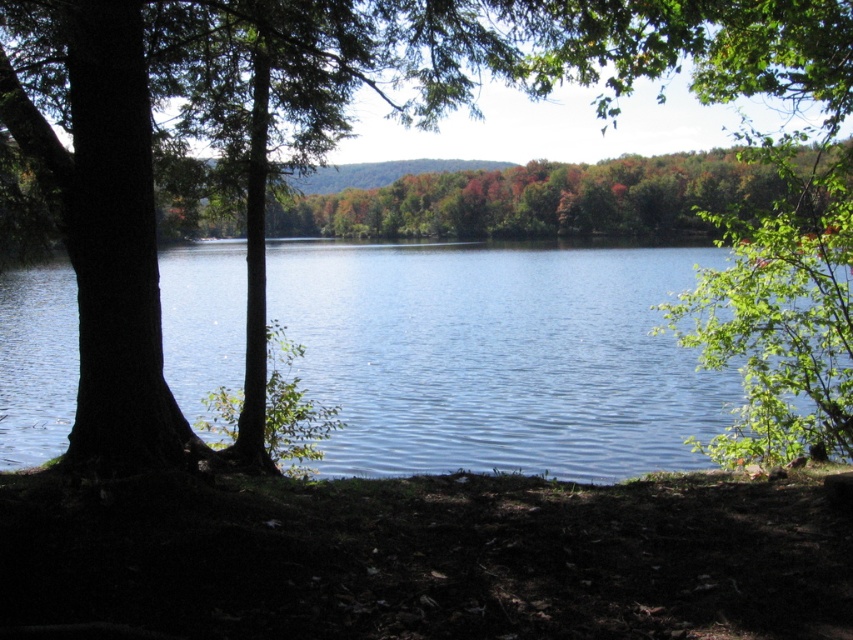
The image size is (853, 640). What do you see at coordinates (421, 557) in the screenshot?
I see `dull brown dirt at lower center` at bounding box center [421, 557].

In the scene shown: Can you confirm if dull brown dirt at lower center is positioned to the right of blue water at center?

No, dull brown dirt at lower center is not to the right of blue water at center.

Is point (618, 579) closer to camera compared to point (351, 342)?

Yes.

Where is `dull brown dirt at lower center`? dull brown dirt at lower center is located at coordinates (421, 557).